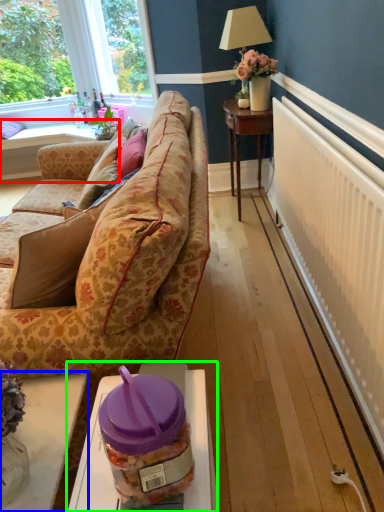
Question: Which is farther away from table (highlighted by a red box)? table (highlighted by a blue box) or table (highlighted by a green box)?

Choices:
 (A) table
 (B) table

Answer: (B)